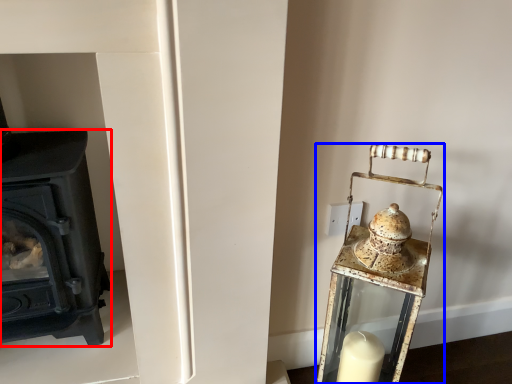
Question: Which point is further to the camera, wood burning stove (highlighted by a red box) or table lamp (highlighted by a blue box)?

Choices:
 (A) wood burning stove
 (B) table lamp

Answer: (A)